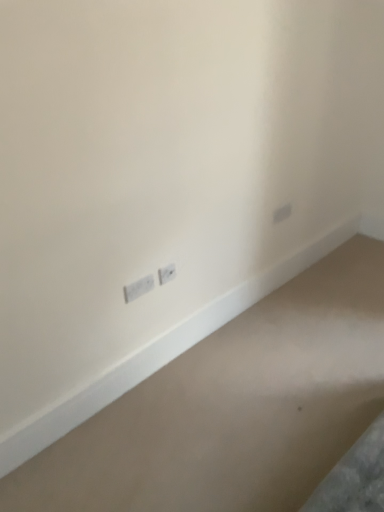
Image resolution: width=384 pixels, height=512 pixels. In order to click on vacant region above smooth beige carpet at bottom (from a real-world perspective) in this screenshot , I will do `click(256, 376)`.